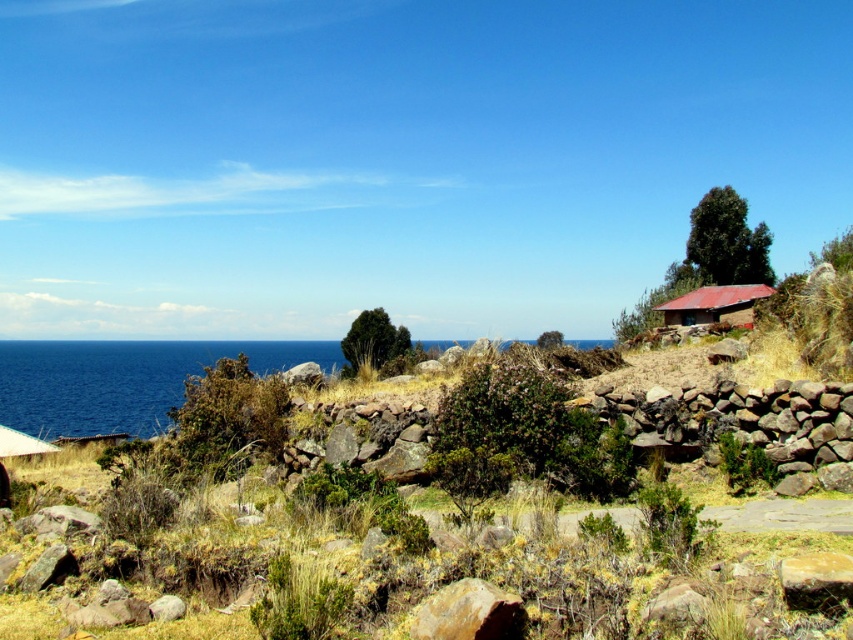
You are a photographer planning to capture the entire scene in one shot. Given that the blue water at left and the brown clay hut at right are both in your frame, which object appears taller in the photograph?

The blue water at left appears taller than the brown clay hut at right in the photograph.

You are standing at the point marked by coordinates point (123, 380) in the image. Looking around, you see blue water at left. Based on the scene description, what direction is the blue water relative to your position?

The blue water at left is located to the left of point (123, 380), as indicated by the coordinates provided.